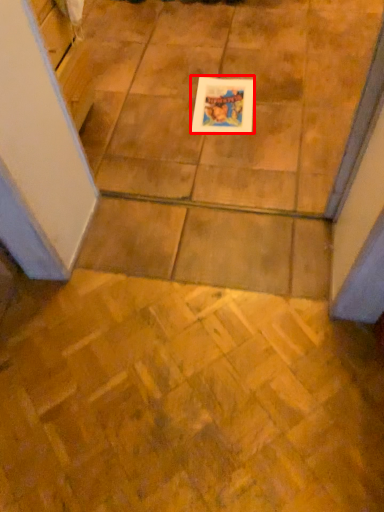
Question: From the image's perspective, what is the correct spatial relationship of picture frame (annotated by the red box) in relation to ceramic tile?

Choices:
 (A) above
 (B) below

Answer: (A)